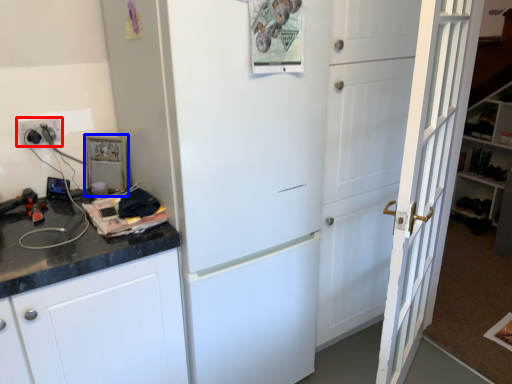
Question: Which point is closer to the camera, electric outlet (highlighted by a red box) or appliance (highlighted by a blue box)?

Choices:
 (A) electric outlet
 (B) appliance

Answer: (A)